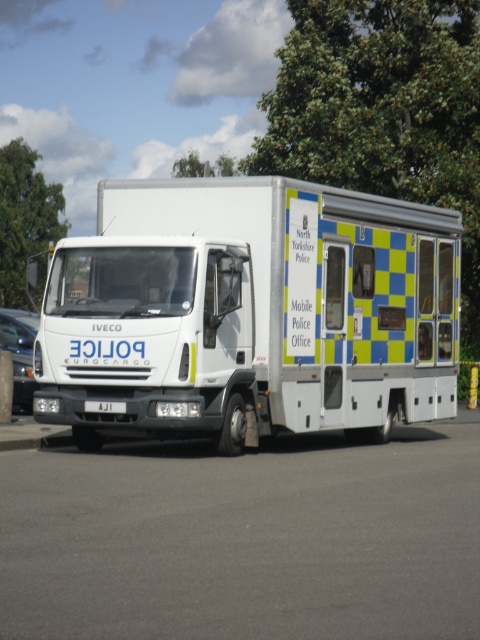
Does white glossy truck at center lie behind white glossy van at left?

That is False.

Does white glossy truck at center come in front of white glossy van at left?

Yes, white glossy truck at center is closer to the viewer.

Is point (193, 376) farther from camera compared to point (17, 380)?

No, it is not.

The height and width of the screenshot is (640, 480). Find the location of `white glossy truck at center`. white glossy truck at center is located at coordinates click(250, 310).

Does point (328, 349) come closer to viewer compared to point (196, 172)?

Yes, it is in front of point (196, 172).

The image size is (480, 640). What do you see at coordinates (250, 310) in the screenshot? I see `white glossy truck at center` at bounding box center [250, 310].

Is point (387, 365) more distant than point (193, 164)?

No, (387, 365) is closer to viewer.

The height and width of the screenshot is (640, 480). What are the coordinates of `white glossy truck at center` in the screenshot? It's located at (250, 310).

Can you confirm if gray asphalt parking lot at center is wider than white plastic license plate at front?

Yes, gray asphalt parking lot at center is wider than white plastic license plate at front.

How far apart are gray asphalt parking lot at center and white plastic license plate at front?

gray asphalt parking lot at center and white plastic license plate at front are 8.67 feet apart.

Is point (287, 484) positioned in front of point (104, 404)?

Yes, point (287, 484) is closer to viewer.

You are a GUI agent. You are given a task and a screenshot of the screen. Output one action in this format:
    pyautogui.click(x=<x>, y=<y>)
    Task: Click on the gray asphalt parking lot at center
    The width and height of the screenshot is (480, 640).
    Given the screenshot: What is the action you would take?
    pyautogui.click(x=245, y=538)